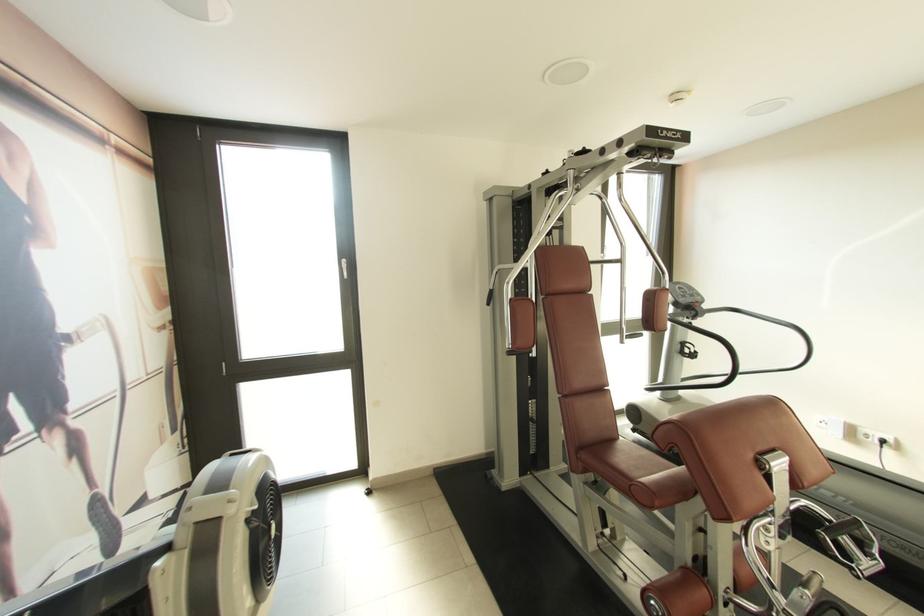
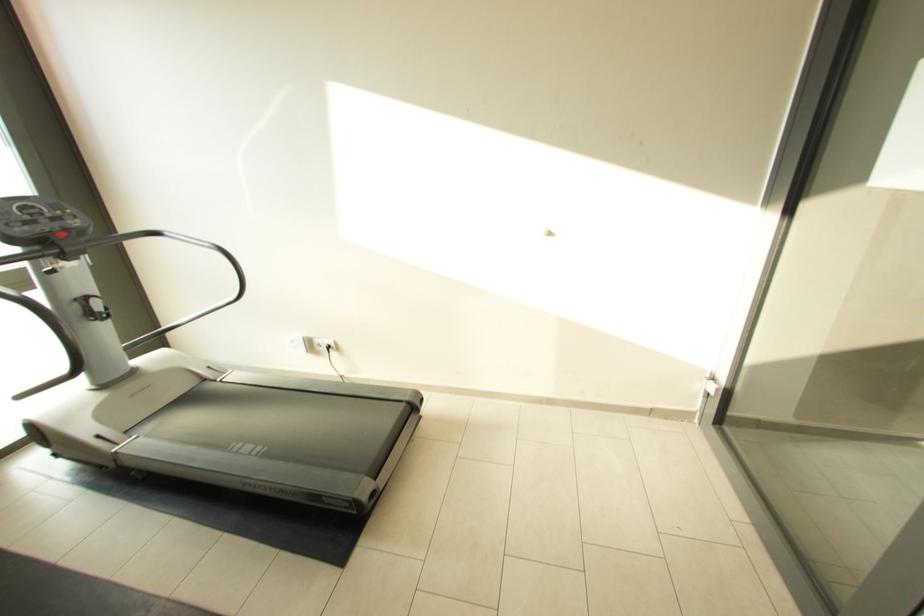
Locate, in the second image, the point that corresponds to the point at 868,432 in the first image.

(322, 342)